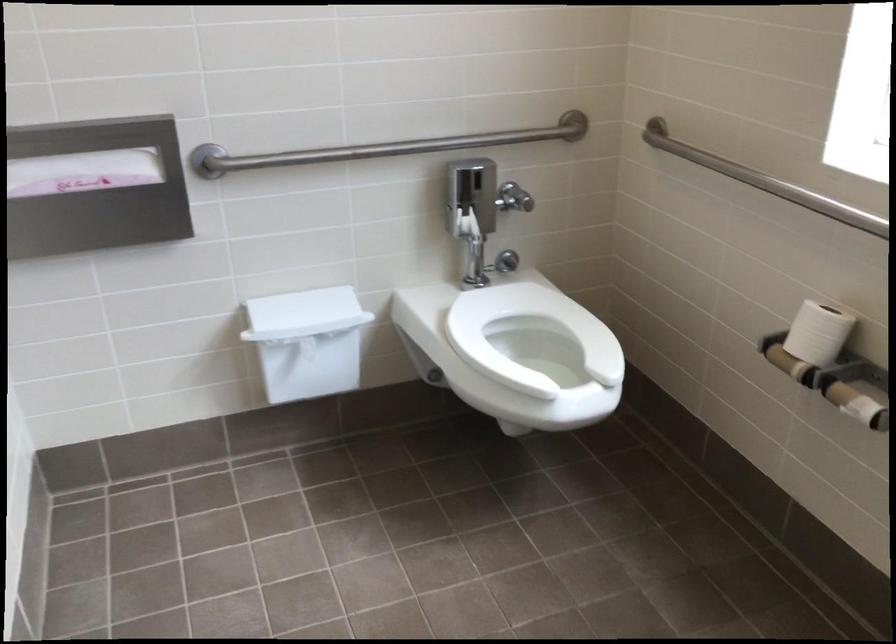
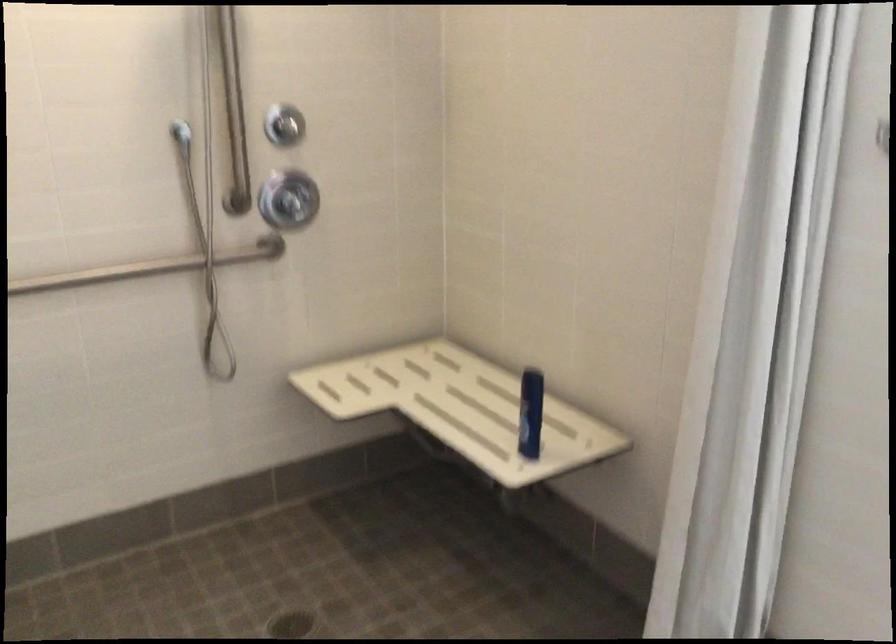
Question: I am providing you with two images of the same scene from different viewpoints. Please identify which objects are invisible in image2.

Choices:
 (A) chrome shower knob
 (B) black bag strap
 (C) metal grab bar
 (D) chair sitting surface

Answer: (C)